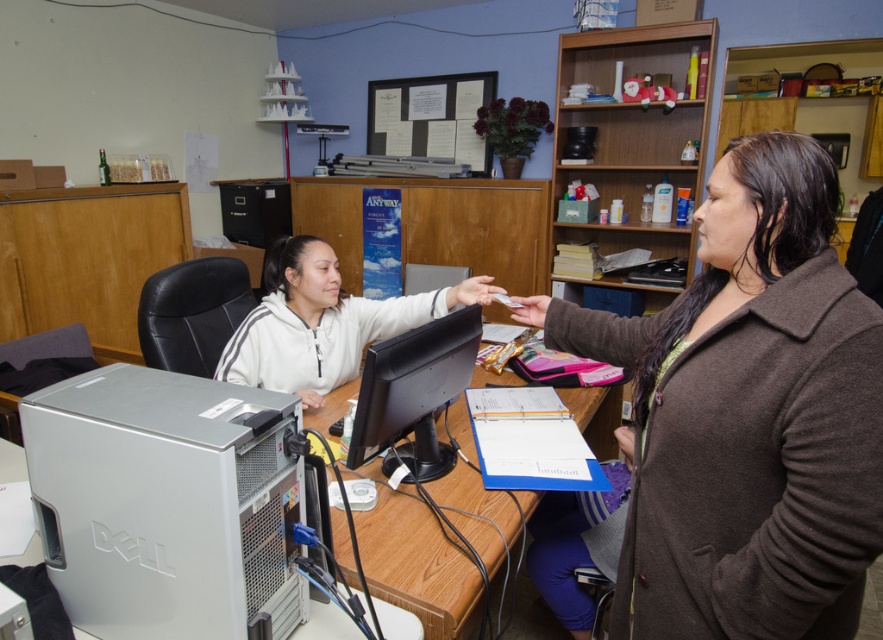
Question: Does white fleece jacket at center appear on the right side of black glossy computer monitor at center?

Choices:
 (A) no
 (B) yes

Answer: (A)

Question: Which point is closer to the camera?

Choices:
 (A) white fleece jacket at center
 (B) silver metallic computer tower at lower left

Answer: (B)

Question: Observing the image, what is the correct spatial positioning of silver metallic computer tower at lower left in reference to black glossy computer monitor at center?

Choices:
 (A) right
 (B) left

Answer: (B)

Question: Which is nearer to the wooden at center?

Choices:
 (A) silver metallic computer tower at lower left
 (B) brown woolen coat at center-right
 (C) black glossy computer monitor at center
 (D) white fleece jacket at center

Answer: (C)

Question: Can you confirm if brown woolen coat at center-right is bigger than wooden at center?

Choices:
 (A) no
 (B) yes

Answer: (A)

Question: Which point appears farthest from the camera in this image?

Choices:
 (A) (451, 605)
 (B) (466, 342)
 (C) (436, 298)
 (D) (881, 461)

Answer: (C)